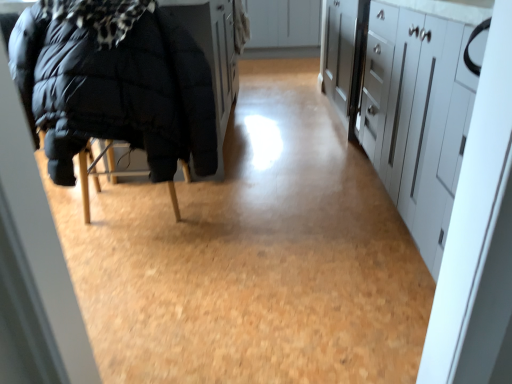
Locate an element on the screen. Image resolution: width=512 pixels, height=384 pixels. white glossy cabinets at right, which is the first cabinetry in bottom-to-top order is located at coordinates (405, 106).

Describe the element at coordinates (116, 91) in the screenshot. I see `black puffy jacket at left` at that location.

Image resolution: width=512 pixels, height=384 pixels. I want to click on white glossy cabinets at right, positioned as the second cabinetry in back-to-front order, so click(x=405, y=106).

How many degrees apart are the facing directions of black puffy jacket at left and white matte cabinet at upper center, placed as the 1th cabinetry when sorted from top to bottom?

They differ by 178 degrees in their facing directions.

Considering the relative sizes of black puffy jacket at left and white matte cabinet at upper center, the second cabinetry when ordered from front to back, in the image provided, is black puffy jacket at left thinner than white matte cabinet at upper center, the second cabinetry when ordered from front to back,?

Correct, the width of black puffy jacket at left is less than that of white matte cabinet at upper center, the second cabinetry when ordered from front to back.

Is point (139, 100) behind point (254, 3)?

No, it is in front of (254, 3).

Can you confirm if black puffy jacket at left is bigger than white matte cabinet at upper center, the second cabinetry when ordered from front to back?

Incorrect, black puffy jacket at left is not larger than white matte cabinet at upper center, the second cabinetry when ordered from front to back.

From the picture: From the image's perspective, which is above, white glossy cabinets at right, the first cabinetry from the front, or white matte cabinet at upper center, the 1th cabinetry positioned from the back?

white matte cabinet at upper center, the 1th cabinetry positioned from the back, from the image's perspective.

Considering the sizes of objects white glossy cabinets at right, the first cabinetry from the front, and white matte cabinet at upper center, which is counted as the second cabinetry, starting from the bottom, in the image provided, who is bigger, white glossy cabinets at right, the first cabinetry from the front, or white matte cabinet at upper center, which is counted as the second cabinetry, starting from the bottom,?

white glossy cabinets at right, the first cabinetry from the front.

From a real-world perspective, is white glossy cabinets at right, positioned as the second cabinetry in back-to-front order, located beneath white matte cabinet at upper center, the 1th cabinetry positioned from the back?

No, from a real-world perspective, white glossy cabinets at right, positioned as the second cabinetry in back-to-front order, is not below white matte cabinet at upper center, the 1th cabinetry positioned from the back.

Which is nearer, [443,85] or [308,9]?

Point [443,85] appears to be closer to the viewer than point [308,9].

From the image's perspective, which is below, black puffy jacket at left or white glossy cabinets at right, the first cabinetry from the front?

white glossy cabinets at right, the first cabinetry from the front, is shown below in the image.

Is black puffy jacket at left bigger or smaller than white glossy cabinets at right, which is the first cabinetry in bottom-to-top order?

In the image, black puffy jacket at left appears to be smaller than white glossy cabinets at right, which is the first cabinetry in bottom-to-top order.

From a real-world perspective, is black puffy jacket at left positioned above or below white glossy cabinets at right, arranged as the 2th cabinetry when viewed from the top?

In terms of real-world spatial position, black puffy jacket at left is above white glossy cabinets at right, arranged as the 2th cabinetry when viewed from the top.

Consider the image. From the image's perspective, is white matte cabinet at upper center, the 1th cabinetry positioned from the back, positioned above or below black puffy jacket at left?

white matte cabinet at upper center, the 1th cabinetry positioned from the back, is above black puffy jacket at left.

Can you confirm if white matte cabinet at upper center, the second cabinetry when ordered from front to back, is bigger than black puffy jacket at left?

Yes.

Does point (272, 45) come farther from viewer compared to point (106, 135)?

That is True.

Can you confirm if white matte cabinet at upper center, the second cabinetry when ordered from front to back, is positioned to the right of black puffy jacket at left?

Yes.

In terms of width, does white matte cabinet at upper center, placed as the 1th cabinetry when sorted from top to bottom, look wider or thinner when compared to white glossy cabinets at right, arranged as the 2th cabinetry when viewed from the top?

Considering their sizes, white matte cabinet at upper center, placed as the 1th cabinetry when sorted from top to bottom, looks broader than white glossy cabinets at right, arranged as the 2th cabinetry when viewed from the top.

Does point (249, 6) come behind point (365, 135)?

Yes, it is behind point (365, 135).

Does white matte cabinet at upper center, which is counted as the second cabinetry, starting from the bottom, appear on the left side of white glossy cabinets at right, arranged as the 2th cabinetry when viewed from the top?

Yes.

From a real-world perspective, between white matte cabinet at upper center, the 1th cabinetry positioned from the back, and white glossy cabinets at right, arranged as the 2th cabinetry when viewed from the top, who is vertically higher?

white glossy cabinets at right, arranged as the 2th cabinetry when viewed from the top.

From a real-world perspective, who is located higher, white glossy cabinets at right, positioned as the second cabinetry in back-to-front order, or black puffy jacket at left?

In real-world perspective, black puffy jacket at left is above.

Is point (468, 115) less distant than point (144, 111)?

Yes, point (468, 115) is closer to viewer.

In the scene shown: From the image's perspective, is white glossy cabinets at right, arranged as the 2th cabinetry when viewed from the top, on black puffy jacket at left?

Actually, white glossy cabinets at right, arranged as the 2th cabinetry when viewed from the top, appears below black puffy jacket at left in the image.

Based on the photo, is white glossy cabinets at right, the first cabinetry from the front, aimed at black puffy jacket at left?

Yes, white glossy cabinets at right, the first cabinetry from the front, is turned towards black puffy jacket at left.

I want to click on the 1st cabinetry to the right when counting from the black puffy jacket at left, so click(283, 23).

You are a GUI agent. You are given a task and a screenshot of the screen. Output one action in this format:
    pyautogui.click(x=<x>, y=<y>)
    Task: Click on the cabinetry above the white matte cabinet at upper center, which is counted as the second cabinetry, starting from the bottom (from a real-world perspective)
    This screenshot has width=512, height=384.
    Given the screenshot: What is the action you would take?
    pyautogui.click(x=405, y=106)

Based on their spatial positions, is white glossy cabinets at right, which is the first cabinetry in bottom-to-top order, or black puffy jacket at left further from white matte cabinet at upper center, the second cabinetry when ordered from front to back?

Based on the image, black puffy jacket at left appears to be further to white matte cabinet at upper center, the second cabinetry when ordered from front to back.

Which object lies nearer to the anchor point black puffy jacket at left, white matte cabinet at upper center, placed as the 1th cabinetry when sorted from top to bottom, or white glossy cabinets at right, which is the first cabinetry in bottom-to-top order?

Among the two, white glossy cabinets at right, which is the first cabinetry in bottom-to-top order, is located nearer to black puffy jacket at left.

Which object lies nearer to the anchor point white matte cabinet at upper center, which is counted as the second cabinetry, starting from the bottom, black puffy jacket at left or white glossy cabinets at right, which is the first cabinetry in bottom-to-top order?

Based on the image, white glossy cabinets at right, which is the first cabinetry in bottom-to-top order, appears to be nearer to white matte cabinet at upper center, which is counted as the second cabinetry, starting from the bottom.

Considering their positions, is black puffy jacket at left positioned closer to white glossy cabinets at right, the first cabinetry from the front, than white matte cabinet at upper center, placed as the 1th cabinetry when sorted from top to bottom?

black puffy jacket at left is positioned closer to the anchor white glossy cabinets at right, the first cabinetry from the front.

Which object lies further to the anchor point white glossy cabinets at right, arranged as the 2th cabinetry when viewed from the top, white matte cabinet at upper center, placed as the 1th cabinetry when sorted from top to bottom, or black puffy jacket at left?

white matte cabinet at upper center, placed as the 1th cabinetry when sorted from top to bottom, is further to white glossy cabinets at right, arranged as the 2th cabinetry when viewed from the top.

Considering their positions, is white glossy cabinets at right, which is the first cabinetry in bottom-to-top order, positioned closer to black puffy jacket at left than white matte cabinet at upper center, the 1th cabinetry positioned from the back?

Among the two, white glossy cabinets at right, which is the first cabinetry in bottom-to-top order, is located nearer to black puffy jacket at left.

Where is `jacket between white glossy cabinets at right, which is the first cabinetry in bottom-to-top order, and white matte cabinet at upper center, the second cabinetry when ordered from front to back, in the front-back direction`? jacket between white glossy cabinets at right, which is the first cabinetry in bottom-to-top order, and white matte cabinet at upper center, the second cabinetry when ordered from front to back, in the front-back direction is located at coordinates (116, 91).